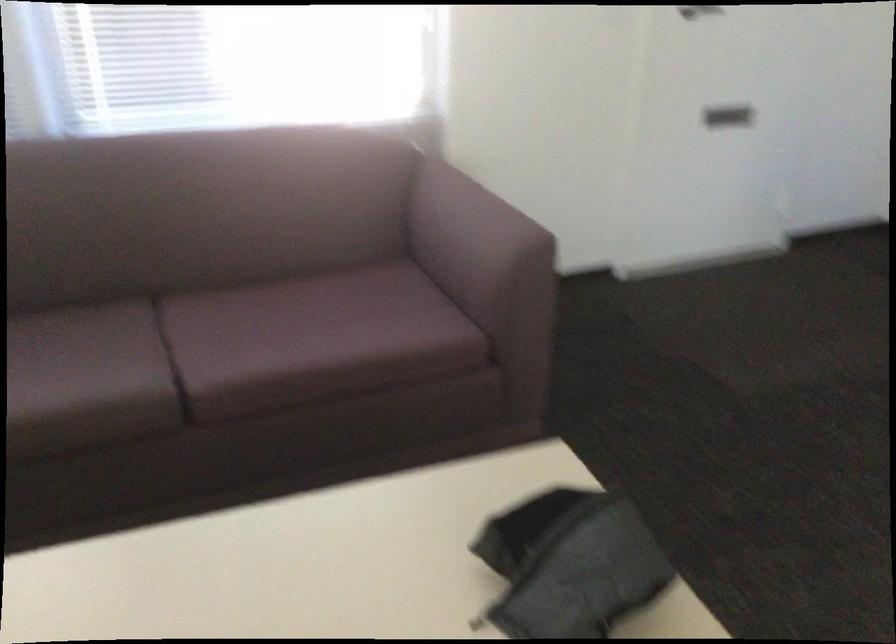
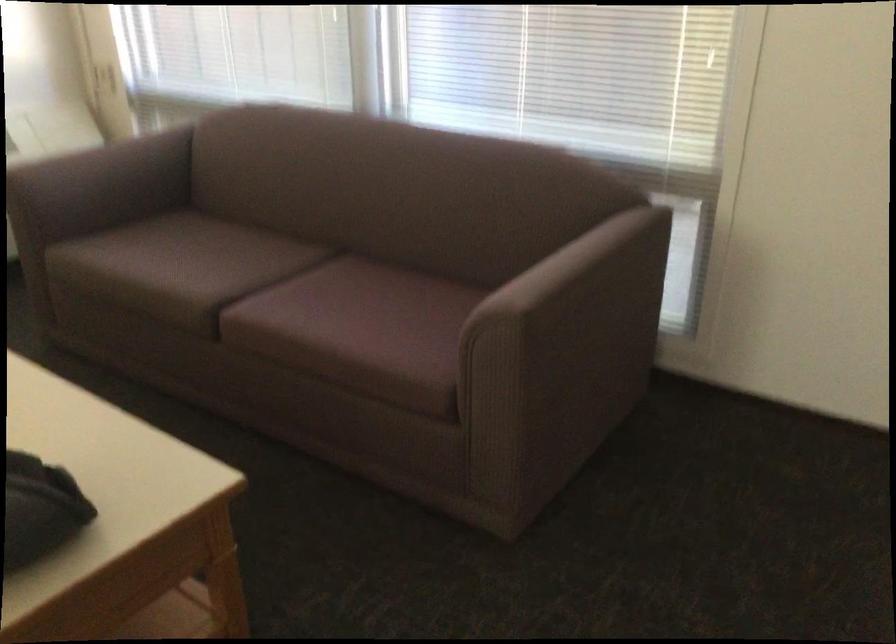
Where in the second image is the point corresponding to (227,351) from the first image?

(277, 299)